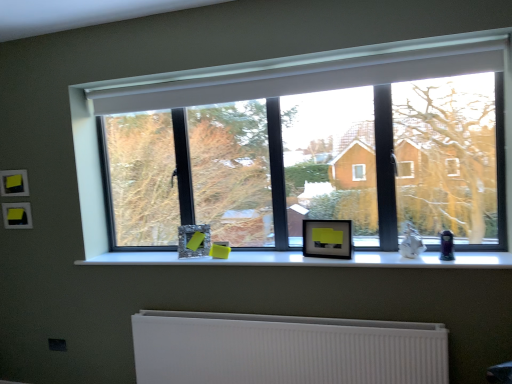
Locate an element on the screen. This screenshot has width=512, height=384. free space in front of matte glass picture frame at center, arranged as the second picture frame when viewed from the front is located at coordinates (201, 258).